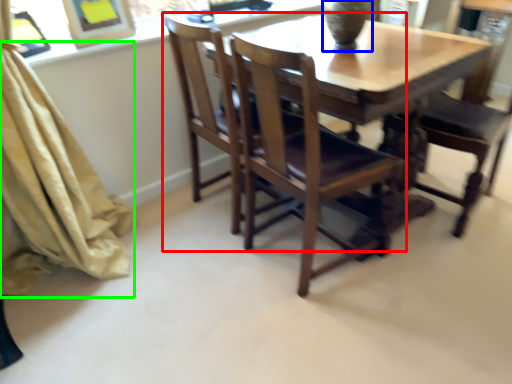
Question: Which object is the farthest from chair (highlighted by a red box)? Choose among these: glass vase (highlighted by a blue box) or curtain (highlighted by a green box).

Choices:
 (A) glass vase
 (B) curtain

Answer: (B)